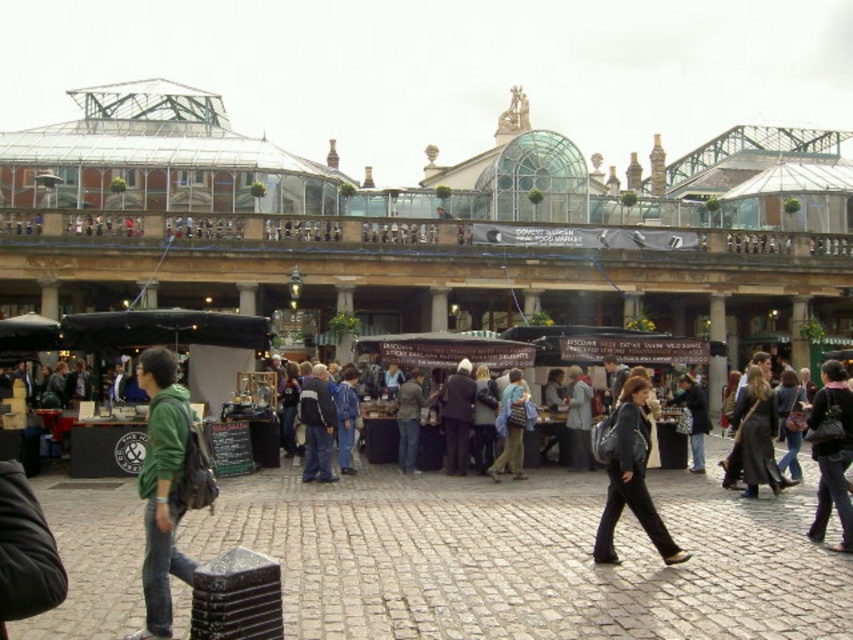
You are standing at the center of the cobblestone plaza in the market scene. There is a green matte jacket at center marked by point (167, 484). If you walk straight ahead, will you move closer to the green matte jacket at center or further away?

The green matte jacket at center is represented by point (167, 484). Since you are already at the center, walking straight ahead would keep you moving away from the jacket, so you would move further away from the green matte jacket at center.

You are a customer at the market and want to try on both the dark gray leather jacket at center and the denim jacket at center. Which jacket should you pick if you want the taller one?

The dark gray leather jacket at center is much taller than the denim jacket at center, so you should pick the dark gray leather jacket at center.